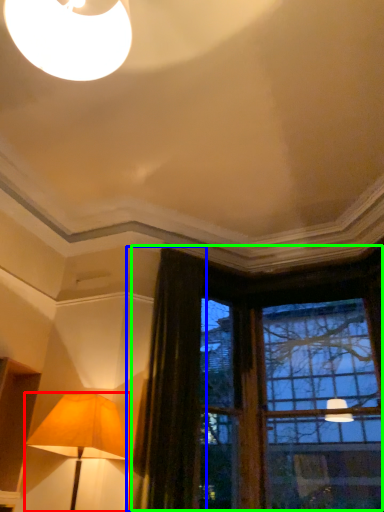
Question: Considering the real-world distances, which object is farthest from lamp (highlighted by a red box)? curtain (highlighted by a blue box) or window (highlighted by a green box)?

Choices:
 (A) curtain
 (B) window

Answer: (B)